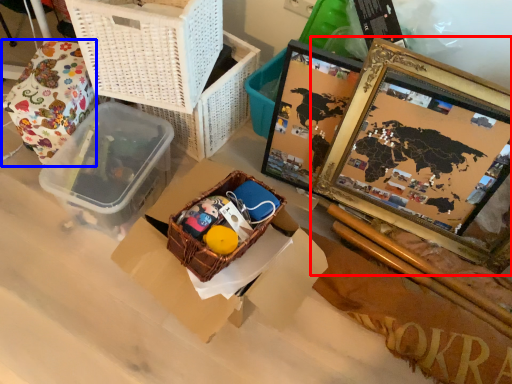
Question: Among these objects, which one is farthest to the camera, picture frame (highlighted by a red box) or wrapping paper (highlighted by a blue box)?

Choices:
 (A) picture frame
 (B) wrapping paper

Answer: (B)